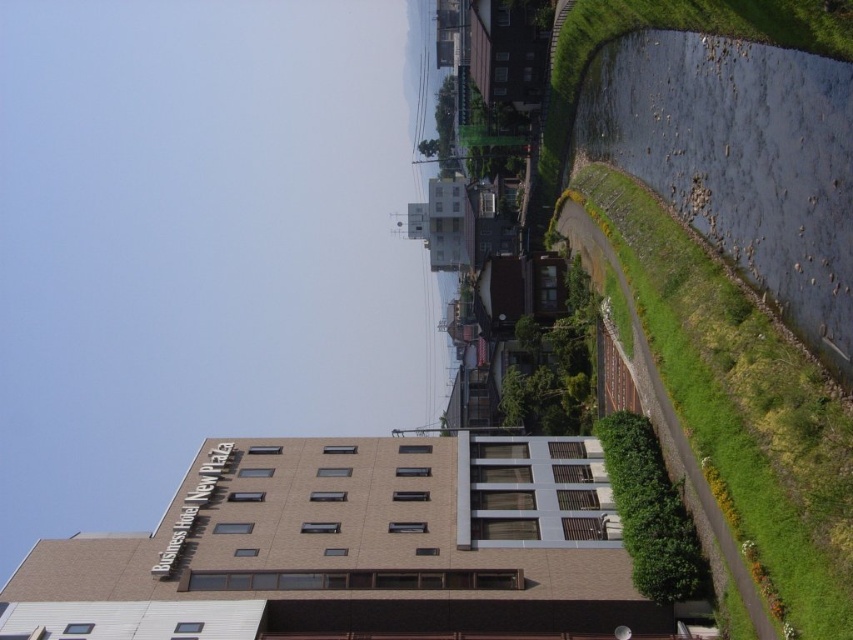
Is brown brick building at center above green grass at right?

No, brown brick building at center is not above green grass at right.

Does brown brick building at center come in front of green grass at right?

That is False.

Image resolution: width=853 pixels, height=640 pixels. I want to click on brown brick building at center, so click(358, 545).